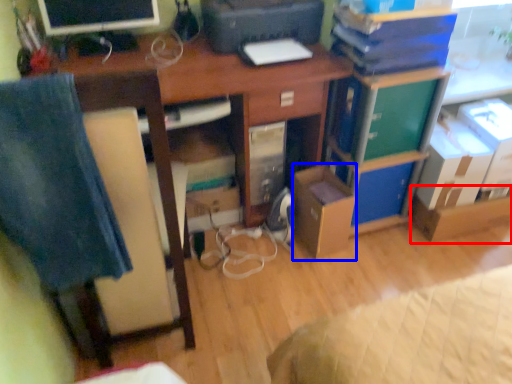
Question: Which object is further to the camera taking this photo, cardboard box (highlighted by a red box) or cardboard box (highlighted by a blue box)?

Choices:
 (A) cardboard box
 (B) cardboard box

Answer: (A)